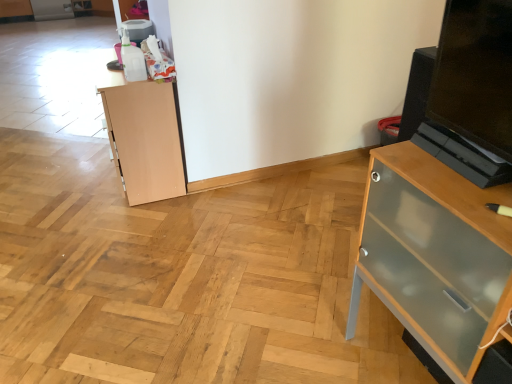
Where is `free space to the left of light brown wood cupboard at left`? The width and height of the screenshot is (512, 384). free space to the left of light brown wood cupboard at left is located at coordinates (67, 174).